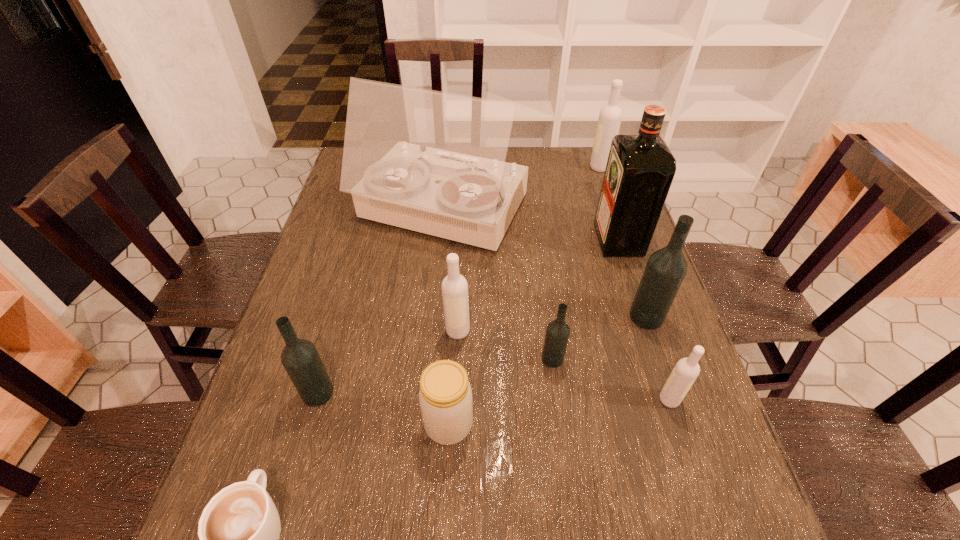
I want to click on vacant space situated on the front of the second smallest white vodka, so click(x=453, y=437).

This screenshot has height=540, width=960. I want to click on free space located on the front of the leftmost black vodka, so click(283, 514).

Identify the location of free space located on the back of the fourth vodka from right to left. (542, 282).

Locate an element on the screen. free point located 0.280m on the back of the smallest white vodka is located at coordinates (635, 292).

Locate an element on the screen. vacant space situated 0.190m on the back of the jar is located at coordinates (454, 329).

This screenshot has height=540, width=960. In order to click on record player that is at the far edge in this screenshot , I will do `click(433, 162)`.

At what (x,y) coordinates should I click in order to perform the action: click on vodka located at the far edge. Please return your answer as a coordinate pair (x, y). Looking at the image, I should click on (610, 116).

In order to click on record player situated at the left edge in this screenshot , I will do `click(433, 162)`.

Where is `vodka positioned at the left edge`? This screenshot has height=540, width=960. vodka positioned at the left edge is located at coordinates (300, 358).

Identify the location of liquor that is at the right edge. The image size is (960, 540). (640, 168).